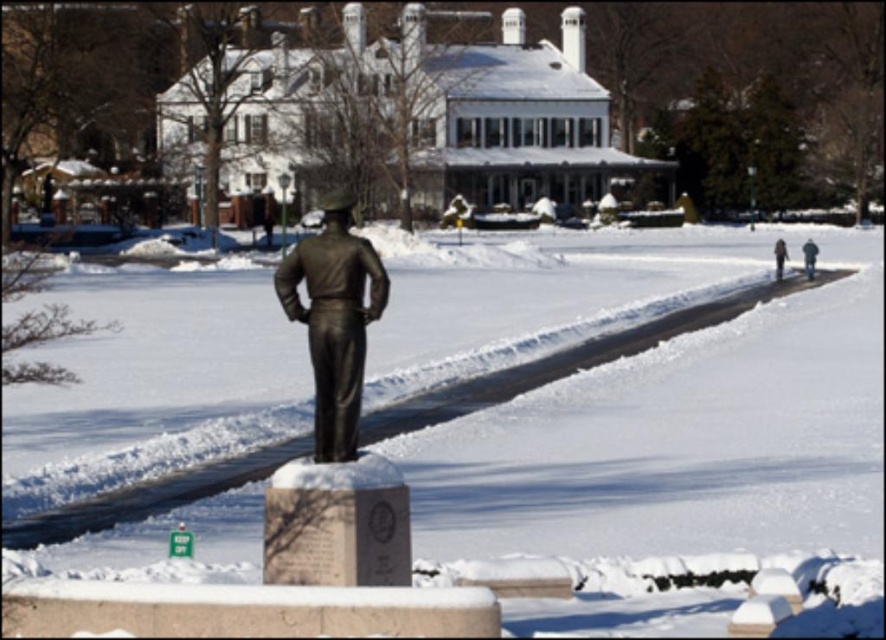
From the picture: You are a photographer trying to capture the bronze statue at center and the dark gray uniform at right in a single shot. Which object will appear larger in your photo?

The bronze statue at center will appear larger in the photo because it is closer to the viewer than the dark gray uniform at right, and objects closer to the camera generally appear larger in photographs.

You are a photographer wanting to capture both the bronze statue at center and the dark brown leather jacket at right in a single shot. Based on their positions, which object should you focus on first to ensure both are in frame?

The bronze statue at center is located below the dark brown leather jacket at right, so you should focus on the bronze statue at center first to ensure both are in frame.